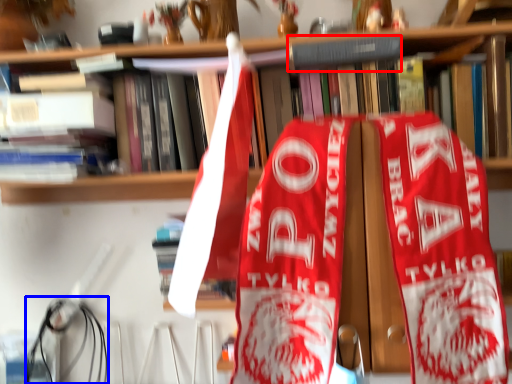
Question: Which point is further to the camera, book (highlighted by a red box) or wire (highlighted by a blue box)?

Choices:
 (A) book
 (B) wire

Answer: (B)